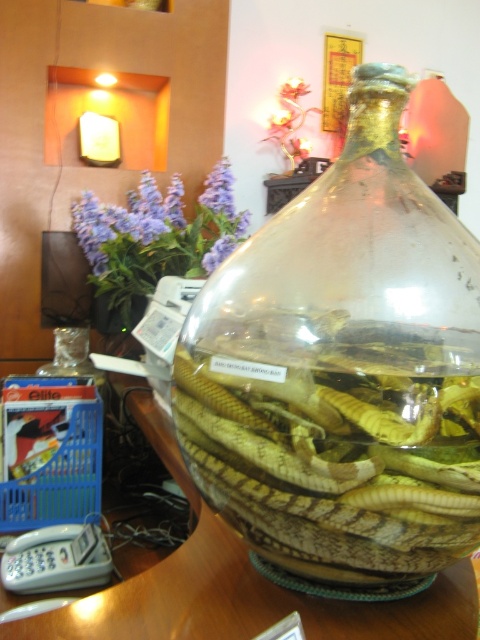
You need to place a decorative item that is 12 inches wide on the wooden table at center. Considering the transparent glass jar at center is already there, will there be enough space?

The transparent glass jar at center is smaller than the wooden table at center, but the exact dimensions of both are not provided. Without knowing the jar size relative to the table, it is impossible to determine if there is enough space for the 12 inch wide decorative item.

You have a small toy car that is 10 cm long. You want to place it on the wooden table at center without it touching the transparent glass jar at center. Can you do this based on their sizes?

The transparent glass jar at center is narrower than the wooden table at center, so yes, you can place the toy car on the wooden table at center away from the jar to avoid contact.

You are standing in front of the bottle with snakes. There are two points marked in the image. One is at coordinates point (287, 330) and the other at point (224, 616). Which point is closer to you?

Point (224, 616) is closer to you because point (287, 330) is behind it.